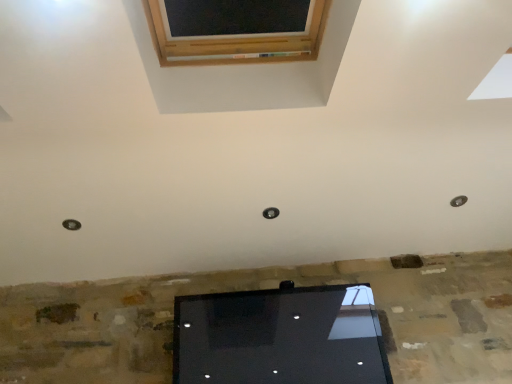
The image size is (512, 384). What do you see at coordinates (71, 224) in the screenshot?
I see `metallic circular hole at lower left, marked as the 2th hole in a right-to-left arrangement` at bounding box center [71, 224].

This screenshot has height=384, width=512. What are the coordinates of `metallic circular hole at lower left, positioned as the 1th hole in front-to-back order` in the screenshot? It's located at (71, 224).

You are a GUI agent. You are given a task and a screenshot of the screen. Output one action in this format:
    pyautogui.click(x=<x>, y=<y>)
    Task: Click on the metallic circular hole at right, the second hole ordered from the bottom
    Image resolution: width=512 pixels, height=384 pixels.
    Given the screenshot: What is the action you would take?
    tap(458, 201)

The image size is (512, 384). What do you see at coordinates (458, 201) in the screenshot?
I see `metallic circular hole at right, the second hole ordered from the bottom` at bounding box center [458, 201].

The width and height of the screenshot is (512, 384). Find the location of `metallic circular hole at lower left, marked as the 2th hole in a right-to-left arrangement`. metallic circular hole at lower left, marked as the 2th hole in a right-to-left arrangement is located at coordinates (71, 224).

Which is more to the left, metallic circular hole at right, the 2th hole positioned from the left, or metallic circular hole at lower left, which appears as the second hole when viewed from the back?

Positioned to the left is metallic circular hole at lower left, which appears as the second hole when viewed from the back.

Which is behind, metallic circular hole at right, which is the 1th hole from right to left, or metallic circular hole at lower left, the second hole viewed from the top?

metallic circular hole at right, which is the 1th hole from right to left, is more distant.

Considering the positions of points (462, 203) and (76, 222), is point (462, 203) farther from camera compared to point (76, 222)?

Yes, it is behind point (76, 222).

From the image's perspective, which one is positioned higher, metallic circular hole at right, the first hole viewed from the back, or metallic circular hole at lower left, the 1th hole positioned from the bottom?

metallic circular hole at right, the first hole viewed from the back, from the image's perspective.

From a real-world perspective, is metallic circular hole at right, the 2th hole in the front-to-back sequence, positioned under metallic circular hole at lower left, marked as the 2th hole in a right-to-left arrangement, based on gravity?

Yes, from a real-world perspective, metallic circular hole at right, the 2th hole in the front-to-back sequence, is beneath metallic circular hole at lower left, marked as the 2th hole in a right-to-left arrangement.

Between metallic circular hole at right, which ranks as the first hole in top-to-bottom order, and metallic circular hole at lower left, marked as the 2th hole in a right-to-left arrangement, which one has smaller width?

metallic circular hole at right, which ranks as the first hole in top-to-bottom order.

Is metallic circular hole at right, the 2th hole positioned from the left, taller or shorter than metallic circular hole at lower left, the 1th hole positioned from the bottom?

Considering their sizes, metallic circular hole at right, the 2th hole positioned from the left, has less height than metallic circular hole at lower left, the 1th hole positioned from the bottom.

Considering the sizes of objects metallic circular hole at right, the 2th hole in the front-to-back sequence, and metallic circular hole at lower left, which appears as the second hole when viewed from the back, in the image provided, who is smaller, metallic circular hole at right, the 2th hole in the front-to-back sequence, or metallic circular hole at lower left, which appears as the second hole when viewed from the back,?

metallic circular hole at right, the 2th hole in the front-to-back sequence, is smaller.

Is metallic circular hole at lower left, the 1th hole positioned from the bottom, completely or partially inside metallic circular hole at right, which is the 1th hole from right to left?

No, metallic circular hole at lower left, the 1th hole positioned from the bottom, is not a part of metallic circular hole at right, which is the 1th hole from right to left.

Are metallic circular hole at right, which is the 1th hole from right to left, and metallic circular hole at lower left, the 1th hole positioned from the bottom, making contact?

There is a gap between metallic circular hole at right, which is the 1th hole from right to left, and metallic circular hole at lower left, the 1th hole positioned from the bottom.

Could you tell me if metallic circular hole at right, the first hole viewed from the back, is turned towards metallic circular hole at lower left, the 1th hole positioned from the bottom?

No, metallic circular hole at right, the first hole viewed from the back, is not turned towards metallic circular hole at lower left, the 1th hole positioned from the bottom.

In the scene shown: How different are the orientations of metallic circular hole at right, the 2th hole positioned from the left, and metallic circular hole at lower left, placed as the 1th hole when sorted from left to right, in degrees?

They differ by 0.000979 degrees in their facing directions.

In the image, there is a metallic circular hole at right, the first hole viewed from the back. Identify the location of hole below it (from the image's perspective). (71, 224).

Can you confirm if metallic circular hole at lower left, the 1th hole positioned from the bottom, is positioned to the right of metallic circular hole at right, which ranks as the first hole in top-to-bottom order?

No.

Which object is further away from the camera taking this photo, metallic circular hole at lower left, placed as the 1th hole when sorted from left to right, or metallic circular hole at right, the second hole ordered from the bottom?

metallic circular hole at right, the second hole ordered from the bottom, is further from the camera.

Is point (75, 227) farther from viewer compared to point (464, 201)?

That is False.

From the image's perspective, is metallic circular hole at lower left, the 1th hole positioned from the bottom, positioned above or below metallic circular hole at right, the first hole viewed from the back?

Clearly, from the image's perspective, metallic circular hole at lower left, the 1th hole positioned from the bottom, is below metallic circular hole at right, the first hole viewed from the back.

From a real-world perspective, relative to metallic circular hole at right, the second hole ordered from the bottom, is metallic circular hole at lower left, marked as the 2th hole in a right-to-left arrangement, vertically above or below?

From a real-world perspective, metallic circular hole at lower left, marked as the 2th hole in a right-to-left arrangement, is physically above metallic circular hole at right, the second hole ordered from the bottom.

From the picture: In terms of width, does metallic circular hole at lower left, placed as the 1th hole when sorted from left to right, look wider or thinner when compared to metallic circular hole at right, the 2th hole in the front-to-back sequence?

Clearly, metallic circular hole at lower left, placed as the 1th hole when sorted from left to right, has more width compared to metallic circular hole at right, the 2th hole in the front-to-back sequence.

Is metallic circular hole at lower left, positioned as the 1th hole in front-to-back order, taller than metallic circular hole at right, the 2th hole in the front-to-back sequence?

Yes.

Between metallic circular hole at lower left, positioned as the 1th hole in front-to-back order, and metallic circular hole at right, which is the 1th hole from right to left, which one has larger size?

Bigger between the two is metallic circular hole at lower left, positioned as the 1th hole in front-to-back order.

Looking at this image, is metallic circular hole at right, which ranks as the first hole in top-to-bottom order, completely or partially inside metallic circular hole at lower left, the second hole viewed from the top?

No, metallic circular hole at right, which ranks as the first hole in top-to-bottom order, is not inside metallic circular hole at lower left, the second hole viewed from the top.

Are metallic circular hole at lower left, marked as the 2th hole in a right-to-left arrangement, and metallic circular hole at right, the 2th hole in the front-to-back sequence, beside each other?

metallic circular hole at lower left, marked as the 2th hole in a right-to-left arrangement, and metallic circular hole at right, the 2th hole in the front-to-back sequence, are clearly separated.

Could you tell me if metallic circular hole at lower left, the 1th hole positioned from the bottom, is facing metallic circular hole at right, which ranks as the first hole in top-to-bottom order?

No.

How distant is metallic circular hole at lower left, marked as the 2th hole in a right-to-left arrangement, from metallic circular hole at right, the 2th hole positioned from the left?

metallic circular hole at lower left, marked as the 2th hole in a right-to-left arrangement, and metallic circular hole at right, the 2th hole positioned from the left, are 7.42 feet apart.

This screenshot has width=512, height=384. What are the coordinates of `hole on the left of metallic circular hole at right, the 2th hole positioned from the left` in the screenshot? It's located at (71, 224).

Where is `hole lying behind the metallic circular hole at lower left, marked as the 2th hole in a right-to-left arrangement`? hole lying behind the metallic circular hole at lower left, marked as the 2th hole in a right-to-left arrangement is located at coordinates (458, 201).

Image resolution: width=512 pixels, height=384 pixels. In order to click on hole above the metallic circular hole at lower left, placed as the 1th hole when sorted from left to right (from the image's perspective) in this screenshot , I will do `click(458, 201)`.